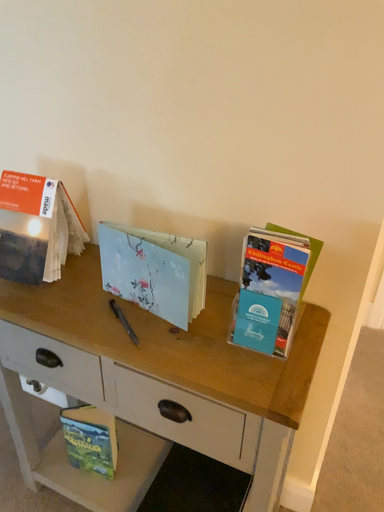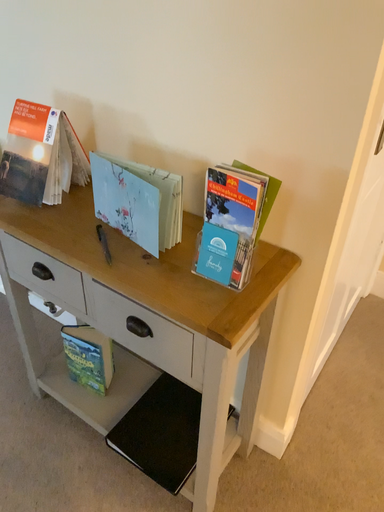
Question: How did the camera likely rotate when shooting the video?

Choices:
 (A) rotated right
 (B) rotated left

Answer: (B)